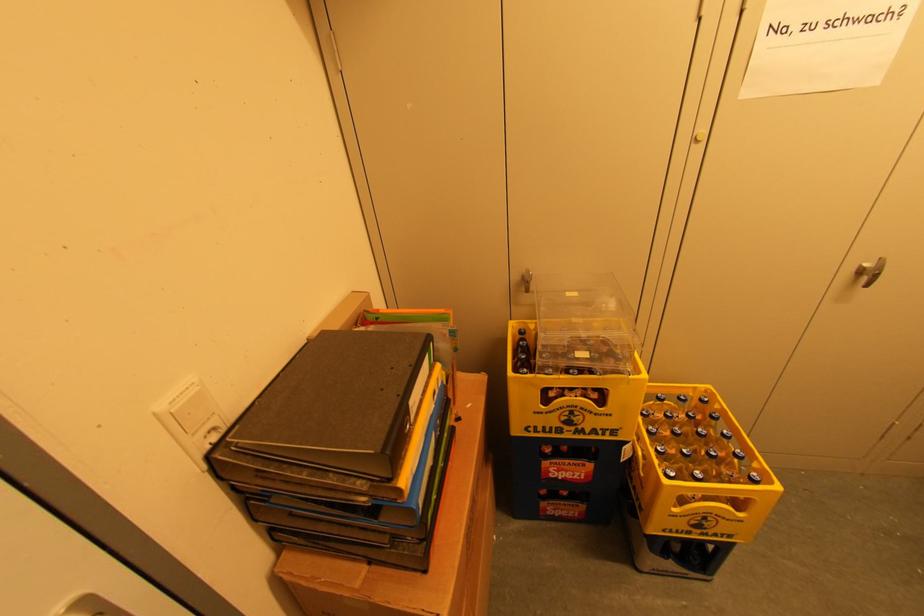
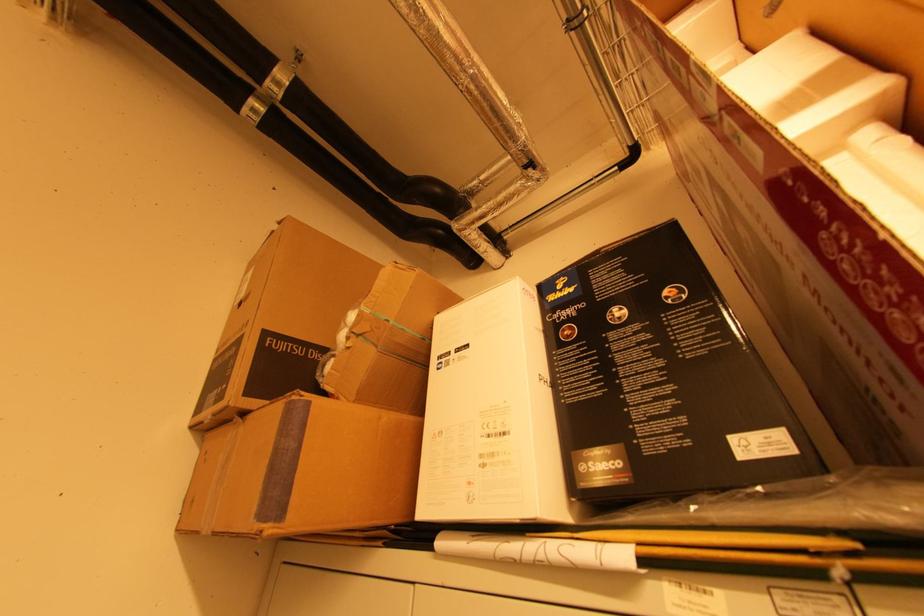
The images are taken continuously from a first-person perspective. In which direction is your viewpoint rotating?

The camera's rotation is toward left-up.